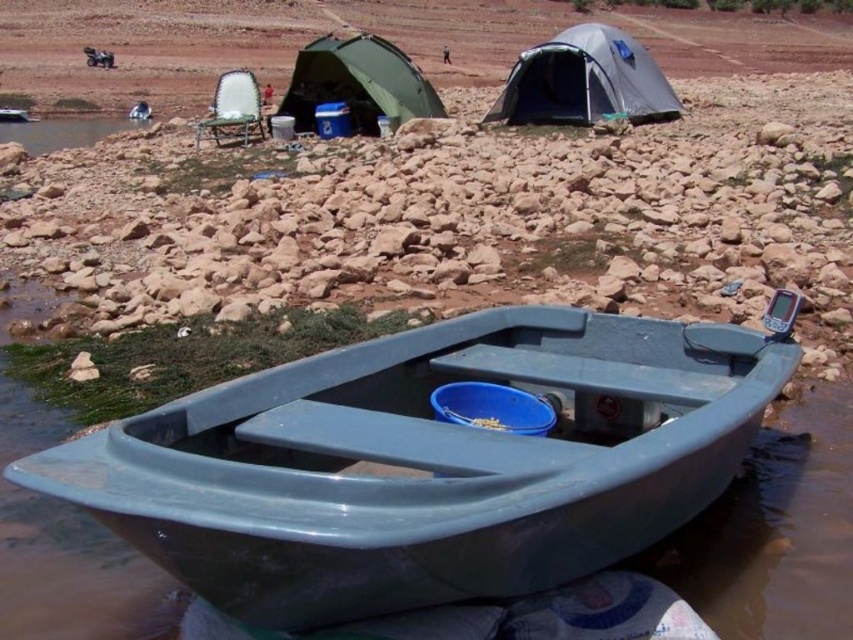
You are planning to set up a campfire between the gray fabric tent at upper center and the green fabric tent at upper center. What is the minimum distance you need to keep the campfire from each tent to ensure both tents are equally distant from the fire?

The minimum distance to keep the campfire equally distant from both tents is 1.46 meters. This is half of the 2.92 meters between the gray fabric tent at upper center and the green fabric tent at upper center.

You are a hiker who wants to set up a tent near the water. You have a gray fabric tent at upper center and a matte plastic boat at lower center in your view. Which object is closer to the water?

The matte plastic boat at lower center is closer to the water because it is positioned below the gray fabric tent at upper center.